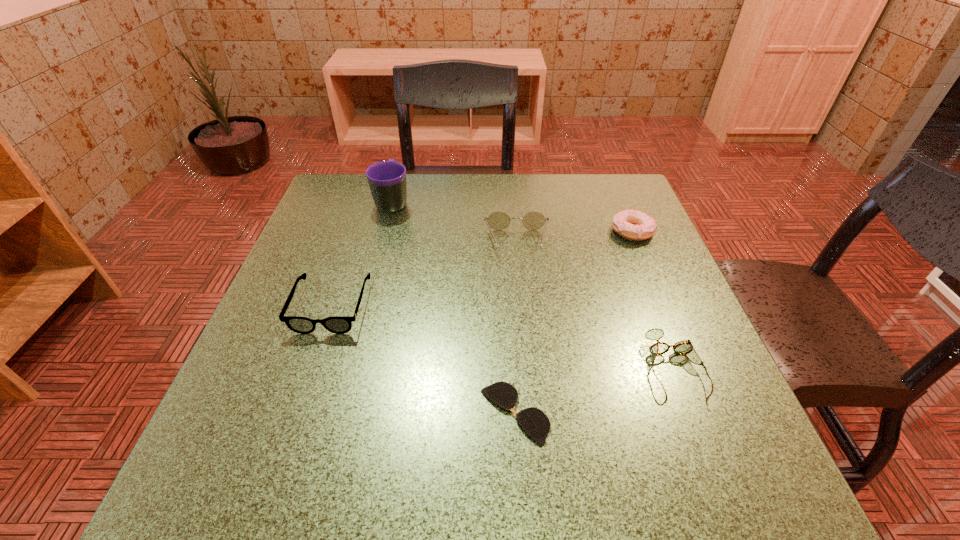
You are a GUI agent. You are given a task and a screenshot of the screen. Output one action in this format:
    pyautogui.click(x=<x>, y=<y>)
    Task: Click on the free spot between the third nearest spectacles and the doughnut
    This screenshot has width=960, height=540.
    Given the screenshot: What is the action you would take?
    pyautogui.click(x=482, y=269)

Identify the location of blank region between the fourth farthest object and the rightmost spectacles. This screenshot has width=960, height=540. (503, 337).

Locate an element on the screen. This screenshot has height=540, width=960. vacant area between the mug and the farthest spectacles is located at coordinates (455, 222).

At what (x,y) coordinates should I click in order to perform the action: click on free space that is in between the fourth farthest object and the shortest object. Please return your answer as a coordinate pair (x, y). The image size is (960, 540). Looking at the image, I should click on (423, 360).

Find the location of a particular element. This screenshot has width=960, height=540. free point between the second tallest spectacles and the farthest spectacles is located at coordinates (424, 274).

Locate an element on the screen. This screenshot has height=540, width=960. unoccupied area between the doughnut and the rightmost spectacles is located at coordinates click(654, 300).

The image size is (960, 540). I want to click on free space between the mug and the doughnut, so click(513, 217).

Locate an element on the screen. This screenshot has width=960, height=540. free space between the tallest object and the third nearest spectacles is located at coordinates (362, 254).

This screenshot has height=540, width=960. I want to click on object that can be found as the third closest to the rightmost spectacles, so click(x=632, y=224).

At what (x,y) coordinates should I click in order to perform the action: click on the closest object to the leftmost spectacles. Please return your answer as a coordinate pair (x, y). Image resolution: width=960 pixels, height=540 pixels. Looking at the image, I should click on [387, 179].